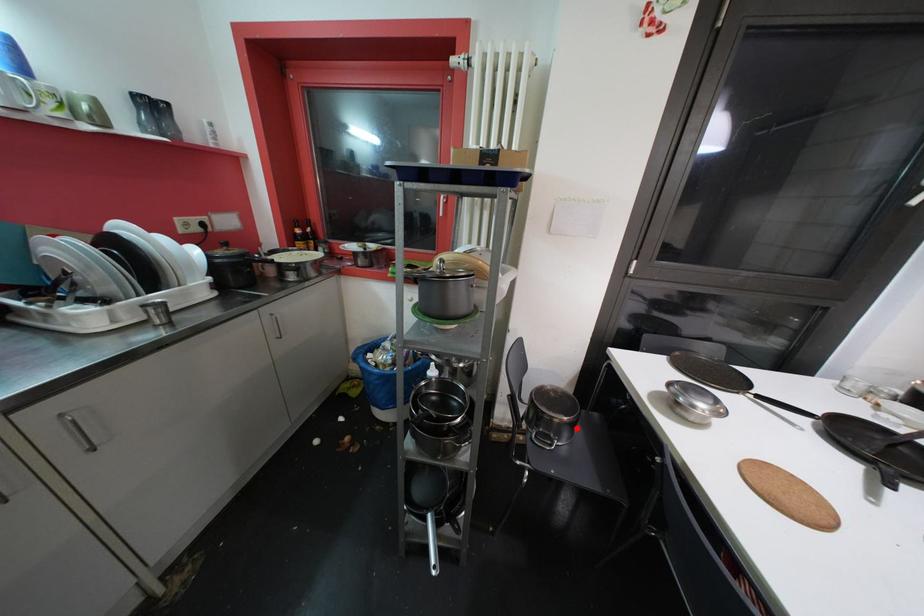
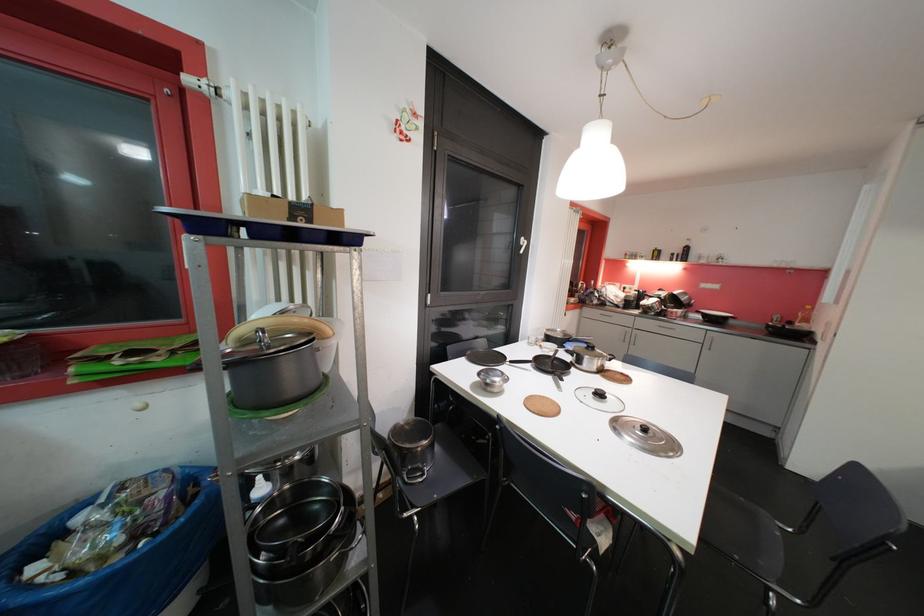
Question: I am providing you with two images of the same scene from different viewpoints. Given a red point in image1, look at the same physical point in image2. Is it:

Choices:
 (A) Closer to the viewpoint
 (B) Farther from the viewpoint

Answer: (A)